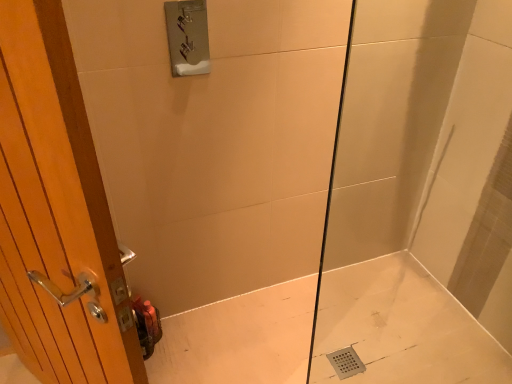
Question: Does white glossy bath at lower right have a larger size compared to wooden door at left?

Choices:
 (A) no
 (B) yes

Answer: (A)

Question: From the image's perspective, does white glossy bath at lower right appear lower than wooden door at left?

Choices:
 (A) no
 (B) yes

Answer: (B)

Question: Can you confirm if white glossy bath at lower right is positioned to the right of wooden door at left?

Choices:
 (A) yes
 (B) no

Answer: (A)

Question: Is wooden door at left surrounded by white glossy bath at lower right?

Choices:
 (A) no
 (B) yes

Answer: (A)

Question: Is white glossy bath at lower right to the left of wooden door at left from the viewer's perspective?

Choices:
 (A) no
 (B) yes

Answer: (A)

Question: From a real-world perspective, relative to white glossy bath at lower right, is transparent glass shower door at center vertically above or below?

Choices:
 (A) below
 (B) above

Answer: (B)

Question: From the image's perspective, relative to white glossy bath at lower right, is transparent glass shower door at center above or below?

Choices:
 (A) above
 (B) below

Answer: (A)

Question: Relative to white glossy bath at lower right, is transparent glass shower door at center in front or behind?

Choices:
 (A) behind
 (B) front

Answer: (B)

Question: Considering the positions of point (376, 297) and point (263, 304), is point (376, 297) closer or farther from the camera than point (263, 304)?

Choices:
 (A) closer
 (B) farther

Answer: (B)

Question: Is wooden door at left spatially inside transparent glass shower door at center, or outside of it?

Choices:
 (A) outside
 (B) inside

Answer: (A)

Question: Looking at their shapes, would you say wooden door at left is wider or thinner than transparent glass shower door at center?

Choices:
 (A) thin
 (B) wide

Answer: (B)

Question: From a real-world perspective, is wooden door at left physically located above or below transparent glass shower door at center?

Choices:
 (A) below
 (B) above

Answer: (A)

Question: From the image's perspective, relative to transparent glass shower door at center, is wooden door at left above or below?

Choices:
 (A) below
 (B) above

Answer: (B)

Question: From a real-world perspective, is white glossy bath at lower right physically located above or below wooden door at left?

Choices:
 (A) below
 (B) above

Answer: (A)

Question: From the image's perspective, is white glossy bath at lower right positioned above or below wooden door at left?

Choices:
 (A) above
 (B) below

Answer: (B)